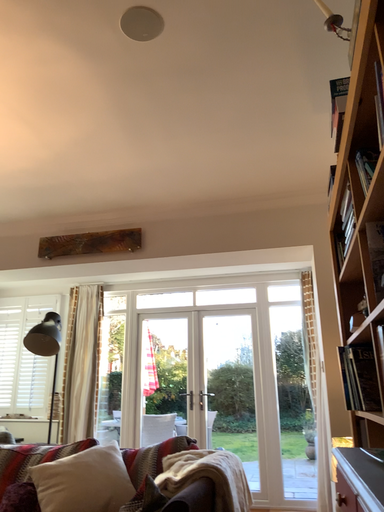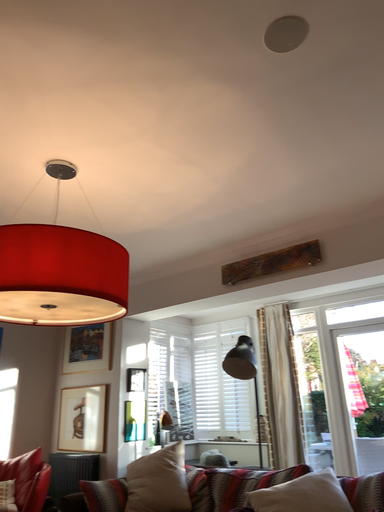
Question: Which way did the camera rotate in the video?

Choices:
 (A) rotated left
 (B) rotated right

Answer: (A)